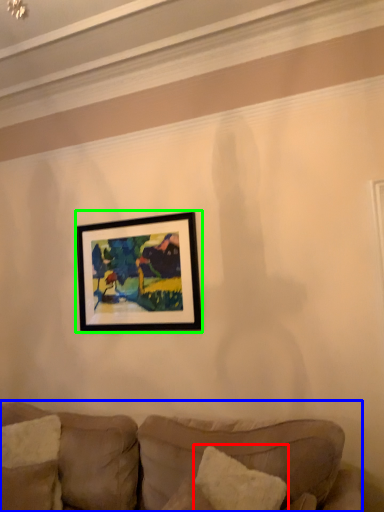
Question: Which object is positioned farthest from pillow (highlighted by a red box)? Select from studio couch (highlighted by a blue box) and picture frame (highlighted by a green box).

Choices:
 (A) studio couch
 (B) picture frame

Answer: (B)